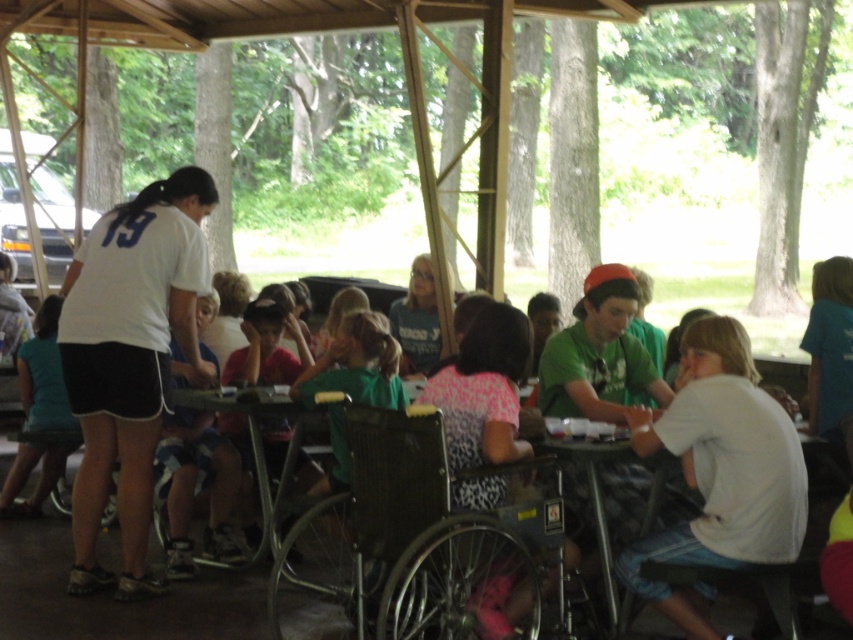
Between metallic gray wheelchair at center and white cotton shirt at lower right, which one has more height?

With more height is white cotton shirt at lower right.

This screenshot has height=640, width=853. In order to click on metallic gray wheelchair at center in this screenshot , I will do `click(370, 536)`.

Is white matte shirt at center thinner than metallic gray wheelchair at center?

Result: Indeed, white matte shirt at center has a lesser width compared to metallic gray wheelchair at center.

Between point (128, 316) and point (384, 529), which one is positioned in front?

Point (384, 529) is more forward.

Where is `white matte shirt at center`? This screenshot has height=640, width=853. white matte shirt at center is located at coordinates (131, 358).

Identify the location of white matte shirt at center. (131, 358).

Is light blue shirt at left closer to camera compared to green plastic table at center?

No, light blue shirt at left is behind green plastic table at center.

Where is `light blue shirt at left`? This screenshot has width=853, height=640. light blue shirt at left is located at coordinates (44, 374).

At what (x,y) coordinates should I click in order to perform the action: click on light blue shirt at left. Please return your answer as a coordinate pair (x, y). Image resolution: width=853 pixels, height=640 pixels. Looking at the image, I should click on (44, 374).